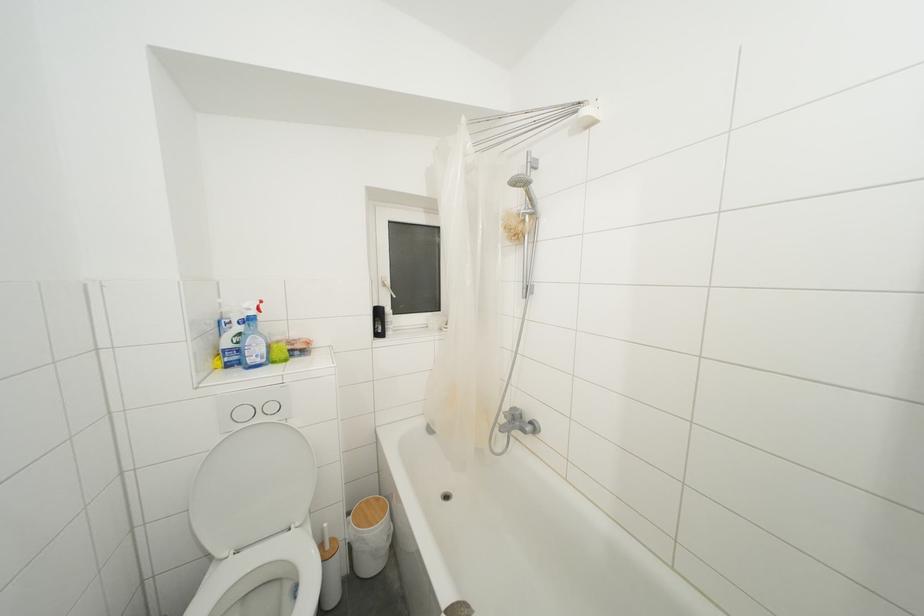
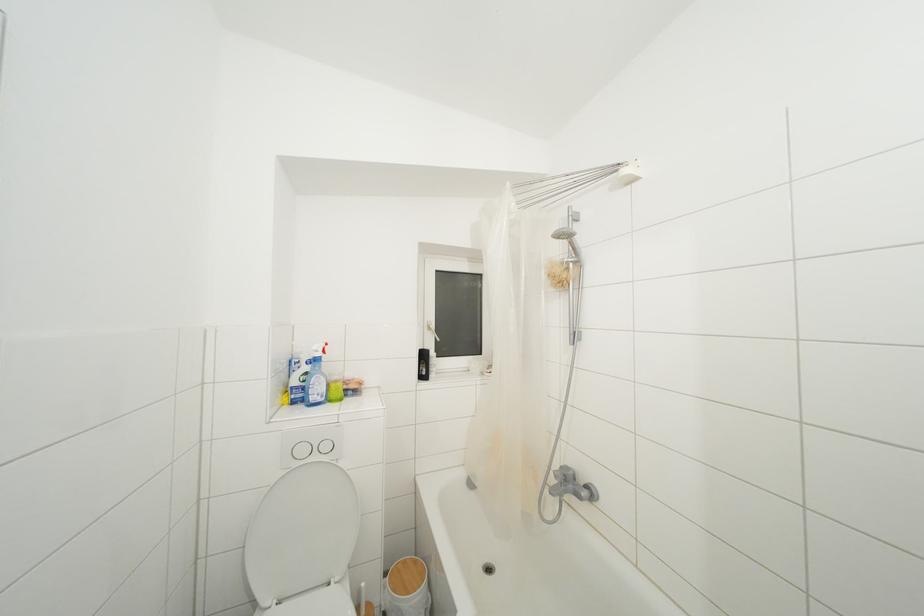
Question: How did the camera likely rotate?

Choices:
 (A) Left
 (B) Right
 (C) Up
 (D) Down

Answer: (C)